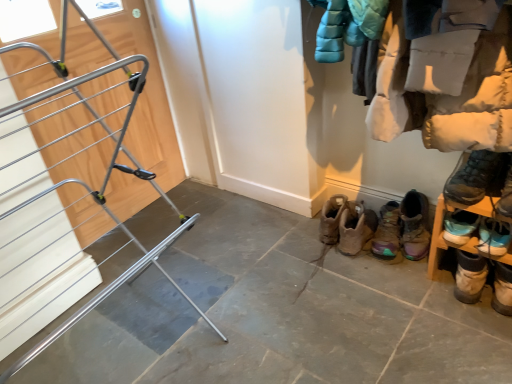
Question: Considering the relative sizes of silver metallic drying rack at left and dark gray suede boot at lower right, placed as the third footwear when sorted from right to left, in the image provided, is silver metallic drying rack at left taller than dark gray suede boot at lower right, placed as the third footwear when sorted from right to left,?

Choices:
 (A) yes
 (B) no

Answer: (A)

Question: Is the depth of silver metallic drying rack at left less than that of dark gray suede boot at lower right, placed as the third footwear when sorted from right to left?

Choices:
 (A) no
 (B) yes

Answer: (B)

Question: From a real-world perspective, is silver metallic drying rack at left over dark gray suede boot at lower right, placed as the third footwear when sorted from right to left?

Choices:
 (A) yes
 (B) no

Answer: (A)

Question: Considering the relative sizes of silver metallic drying rack at left and dark gray suede boot at lower right, the fourth footwear when ordered from left to right, in the image provided, is silver metallic drying rack at left bigger than dark gray suede boot at lower right, the fourth footwear when ordered from left to right,?

Choices:
 (A) no
 (B) yes

Answer: (B)

Question: From the image's perspective, is silver metallic drying rack at left below dark gray suede boot at lower right, placed as the third footwear when sorted from right to left?

Choices:
 (A) yes
 (B) no

Answer: (A)

Question: Looking at the image, does camouflage fabric boot at lower center, which is counted as the 5th footwear, starting from the right, seem bigger or smaller compared to wooden shoe rack at lower right?

Choices:
 (A) big
 (B) small

Answer: (B)

Question: From their relative heights in the image, would you say camouflage fabric boot at lower center, acting as the second footwear starting from the left, is taller or shorter than wooden shoe rack at lower right?

Choices:
 (A) tall
 (B) short

Answer: (B)

Question: In the image, is camouflage fabric boot at lower center, which is counted as the 5th footwear, starting from the right, positioned in front of or behind wooden shoe rack at lower right?

Choices:
 (A) behind
 (B) front

Answer: (A)

Question: Looking at their shapes, would you say camouflage fabric boot at lower center, acting as the second footwear starting from the left, is wider or thinner than wooden shoe rack at lower right?

Choices:
 (A) thin
 (B) wide

Answer: (A)

Question: Which is correct: light brown suede boot at lower right, the fifth footwear when ordered from left to right, is inside blue suede sneakers at lower right, marked as the 6th footwear in a left-to-right arrangement, or outside of it?

Choices:
 (A) outside
 (B) inside

Answer: (A)

Question: Does point (472, 292) appear closer or farther from the camera than point (484, 218)?

Choices:
 (A) closer
 (B) farther

Answer: (B)

Question: Considering their positions, is light brown suede boot at lower right, the fifth footwear when ordered from left to right, located in front of or behind blue suede sneakers at lower right, marked as the 6th footwear in a left-to-right arrangement?

Choices:
 (A) front
 (B) behind

Answer: (B)

Question: Is light brown suede boot at lower right, the fifth footwear when ordered from left to right, taller or shorter than blue suede sneakers at lower right, the 1th footwear viewed from the right?

Choices:
 (A) short
 (B) tall

Answer: (B)

Question: Is point (362, 240) positioned closer to the camera than point (38, 231)?

Choices:
 (A) closer
 (B) farther

Answer: (B)

Question: Looking at the image, does brown suede boot at lower right, which is counted as the sixth footwear, starting from the right, seem bigger or smaller compared to silver metallic drying rack at left?

Choices:
 (A) small
 (B) big

Answer: (A)